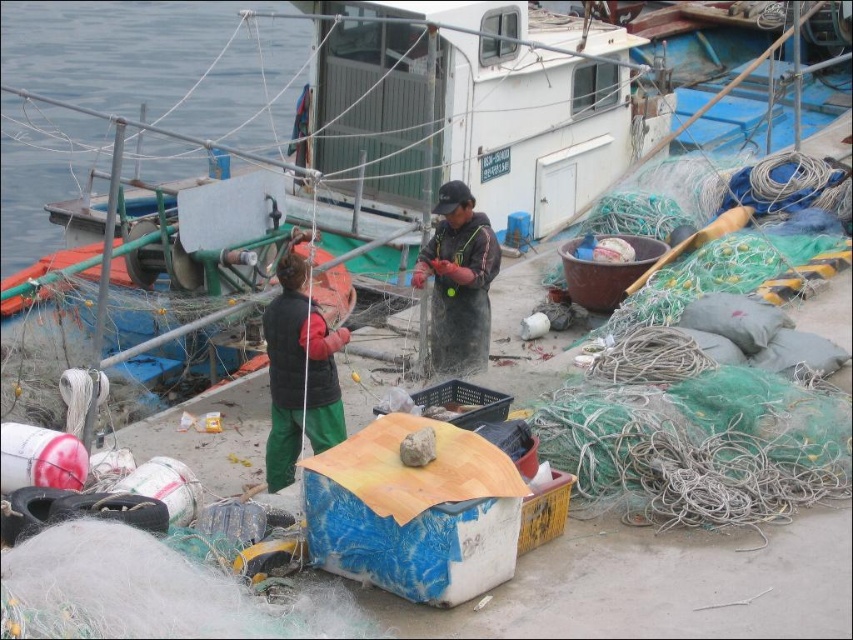
You are a photographer trying to capture both the dark green fabric jacket at center and the dark gray fabric jacket at center in a single frame. Which jacket should you focus on to ensure both are in the frame without moving the camera?

The dark green fabric jacket at center is taller than the dark gray fabric jacket at center, so focusing on the dark green fabric jacket at center will help ensure both are in the frame without needing to adjust the camera angle.

You are a visitor observing the two workers at the dock. Which worker, the one in the dark green fabric jacket at center or the dark gray fabric jacket at center, is closer to you?

The dark green fabric jacket at center is closer to you because it is in front of the dark gray fabric jacket at center.